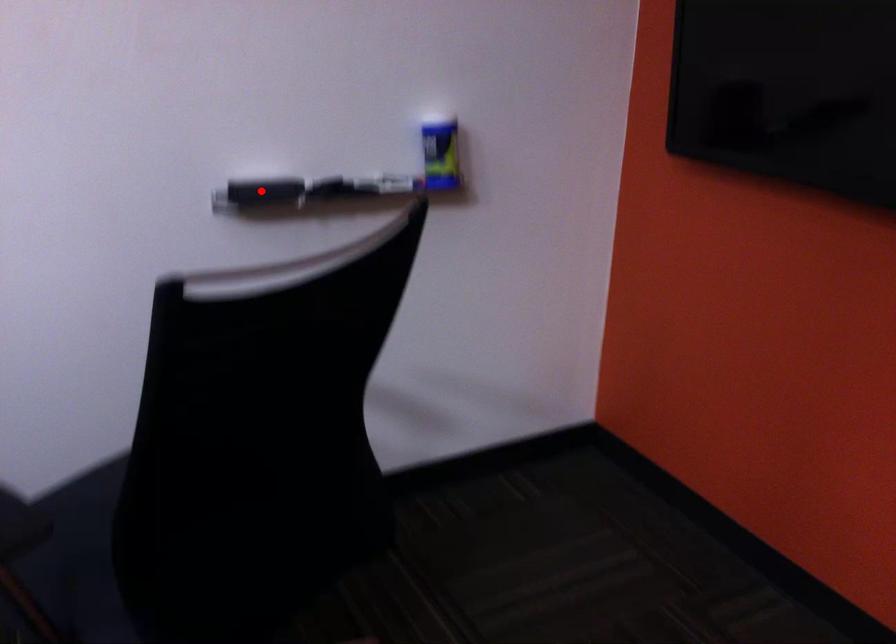
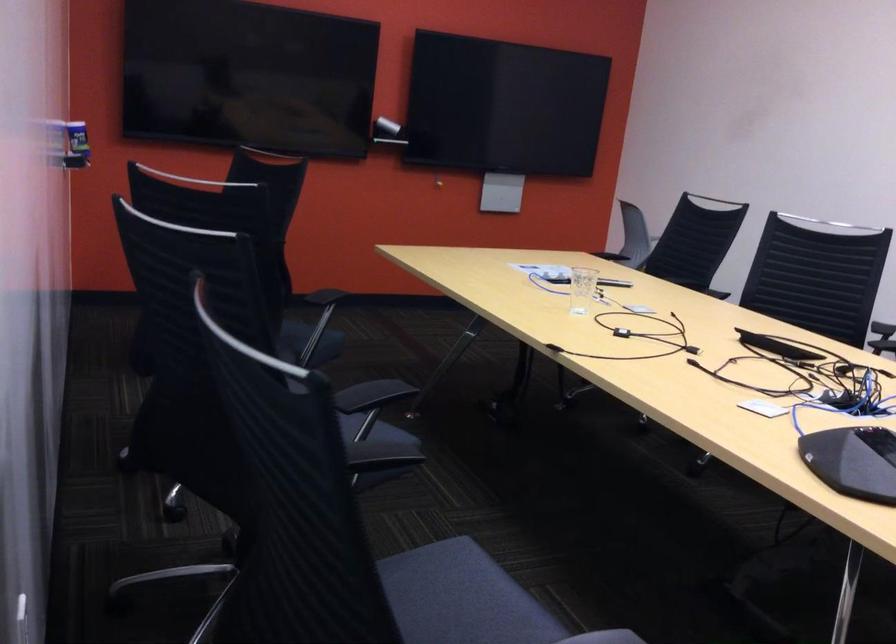
Question: I am providing you with two images of the same scene from different viewpoints. A red point is marked on the first image. Is the red point's position out of view in image 2?

Choices:
 (A) Yes
 (B) No

Answer: (A)